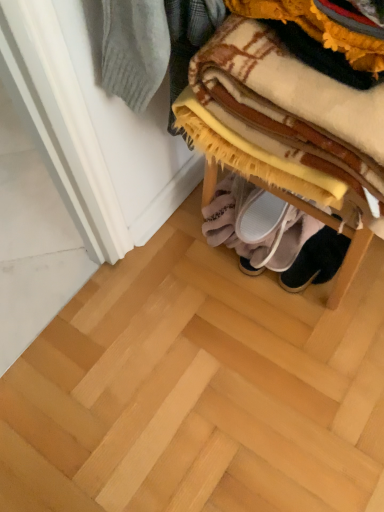
Question: Which is correct: wooden shoe rack at lower right is inside plaid fabric blanket at upper right, or outside of it?

Choices:
 (A) outside
 (B) inside

Answer: (A)

Question: Considering the positions of wooden shoe rack at lower right and plaid fabric blanket at upper right in the image, is wooden shoe rack at lower right wider or thinner than plaid fabric blanket at upper right?

Choices:
 (A) thin
 (B) wide

Answer: (B)

Question: Which object is the farthest from the white fabric slipper at lower center, positioned as the 1th footwear in left-to-right order?

Choices:
 (A) black suede shoes at lower center, which ranks as the first footwear in right-to-left order
 (B) wooden shoe rack at lower right
 (C) plaid fabric blanket at upper right

Answer: (C)

Question: Estimate the real-world distances between objects in this image. Which object is closer to the white fabric slipper at lower center, positioned as the 1th footwear in left-to-right order?

Choices:
 (A) black suede shoes at lower center, placed as the second footwear when sorted from left to right
 (B) plaid fabric blanket at upper right
 (C) wooden shoe rack at lower right

Answer: (A)